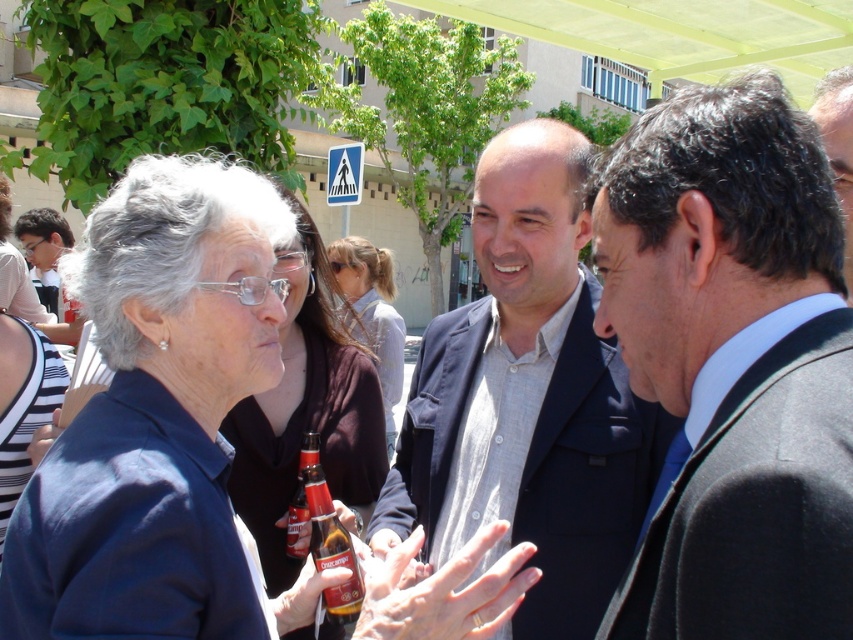
Who is lower down, dark gray suit at center or matte black jacket at center?

matte black jacket at center is lower down.

You are a GUI agent. You are given a task and a screenshot of the screen. Output one action in this format:
    pyautogui.click(x=<x>, y=<y>)
    Task: Click on the dark gray suit at center
    The height and width of the screenshot is (640, 853).
    Given the screenshot: What is the action you would take?
    pyautogui.click(x=733, y=364)

Who is more distant from viewer, (735,576) or (259,538)?

The point (259,538) is more distant.

Identify the location of dark gray suit at center. (733, 364).

Who is shorter, light brown hair at center or brown glass bottle at center?

Standing shorter between the two is brown glass bottle at center.

Is light brown hair at center to the left of brown glass bottle at center from the viewer's perspective?

Correct, you'll find light brown hair at center to the left of brown glass bottle at center.

At what (x,y) coordinates should I click in order to perform the action: click on light brown hair at center. Please return your answer as a coordinate pair (x, y). Looking at the image, I should click on (372, 314).

Looking at this image, is matte blue shirt at center shorter than matte black jacket at center?

Indeed, matte blue shirt at center has a lesser height compared to matte black jacket at center.

Between matte blue shirt at center and matte black jacket at center, which one has less height?

matte blue shirt at center is shorter.

Locate an element on the screen. The width and height of the screenshot is (853, 640). matte blue shirt at center is located at coordinates (155, 417).